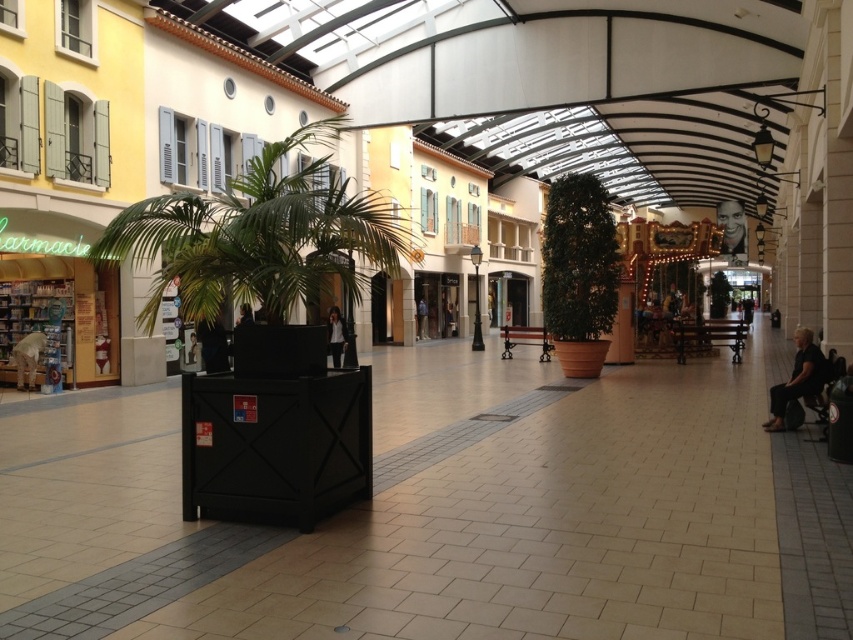
Question: Does smooth skin face at upper right have a smaller size compared to blue denim jacket at center?

Choices:
 (A) yes
 (B) no

Answer: (B)

Question: Which point appears farthest from the camera in this image?

Choices:
 (A) (782, 416)
 (B) (339, 333)

Answer: (B)

Question: Does green leafy palm tree at center have a larger size compared to smooth skin face at upper right?

Choices:
 (A) yes
 (B) no

Answer: (B)

Question: Does black fabric chair at lower right appear over blue denim jacket at center?

Choices:
 (A) no
 (B) yes

Answer: (A)

Question: Which point is closer to the camera?

Choices:
 (A) (418, 326)
 (B) (814, 365)
 (C) (161, 268)
 (D) (722, 221)

Answer: (B)

Question: Which point appears farthest from the camera in this image?

Choices:
 (A) (721, 220)
 (B) (343, 340)
 (C) (419, 337)

Answer: (A)